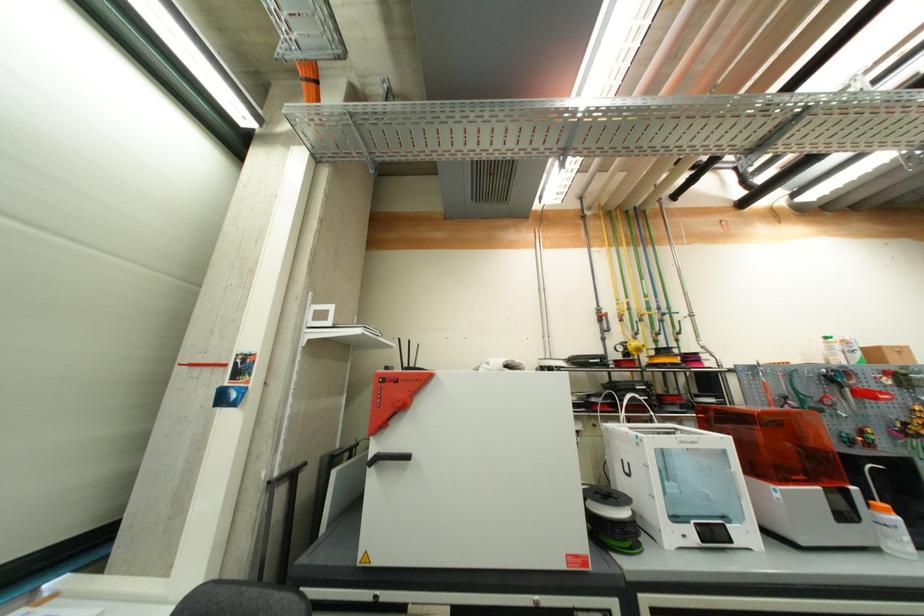
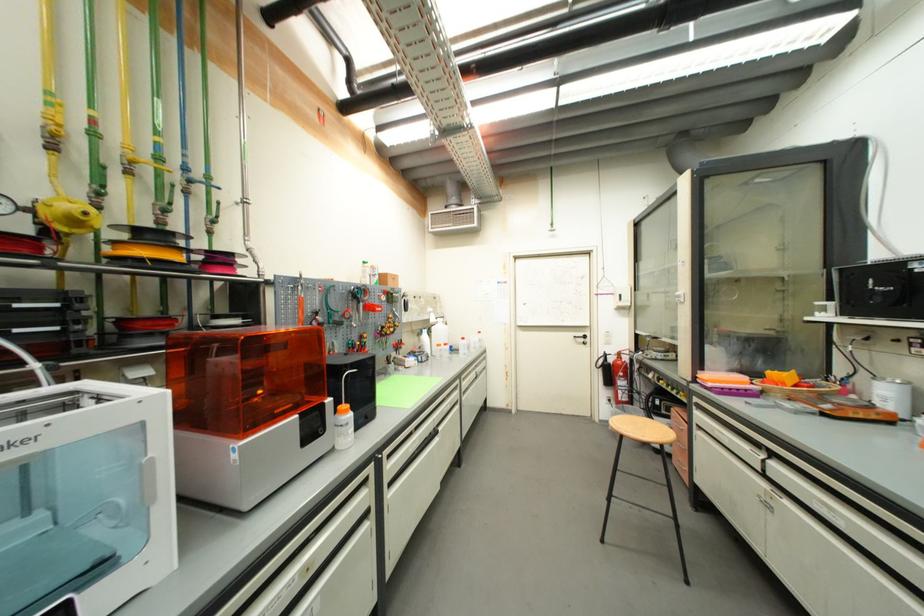
The point at [657,334] is marked in the first image. Where is the corresponding point in the second image?

(160, 207)